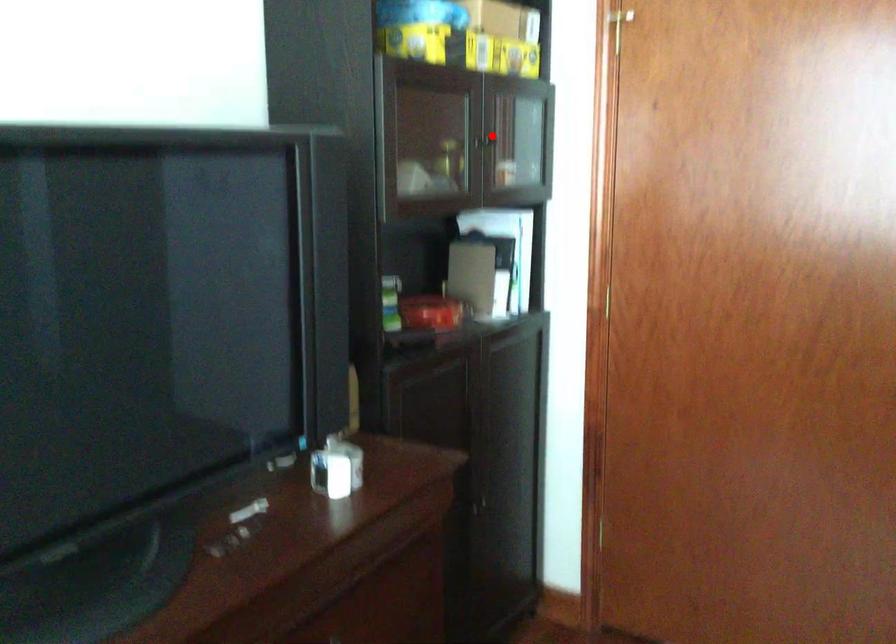
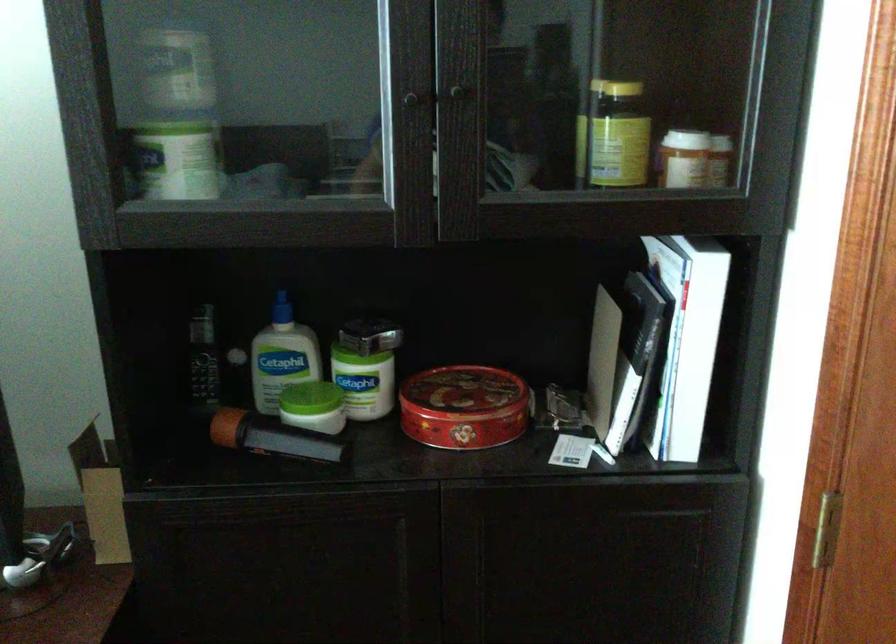
Find the pixel in the second image that matches the highlighted location in the first image.

(454, 91)